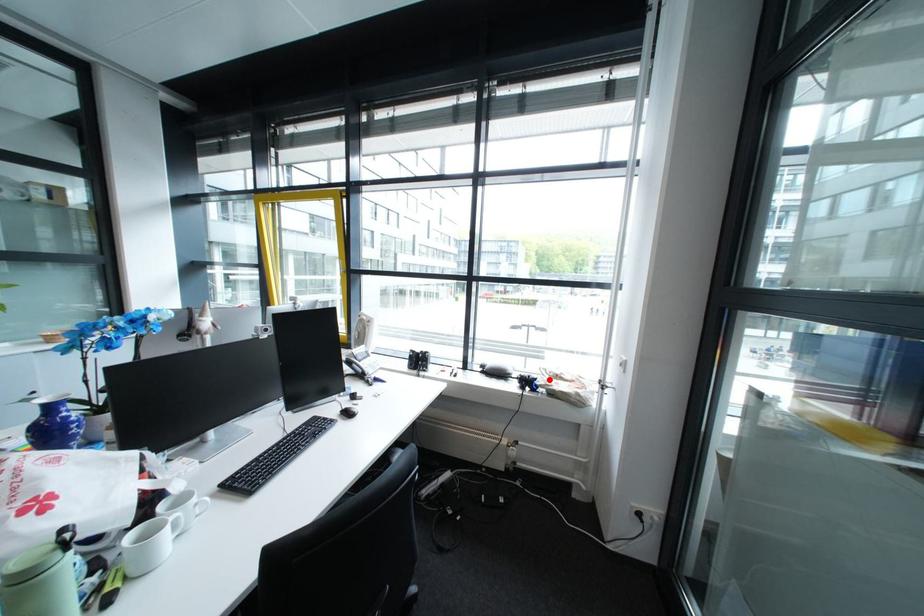
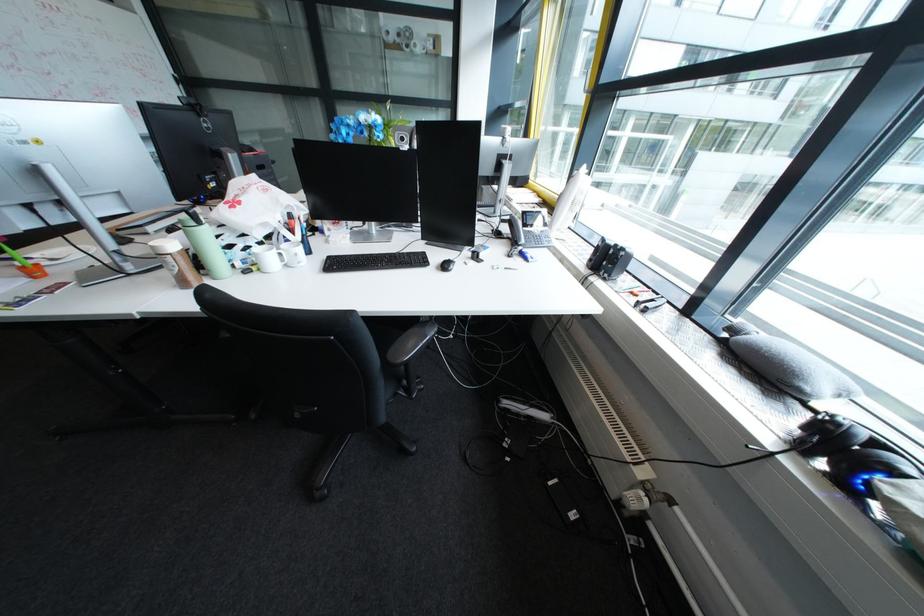
The point at the highlighted location is marked in the first image. Where is the corresponding point in the second image?

(909, 474)